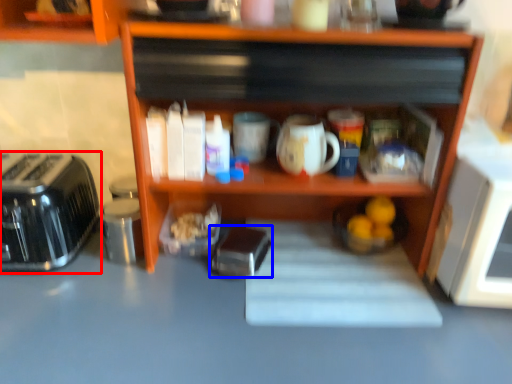
Question: Which object appears closest to the camera in this image, toaster (highlighted by a red box) or appliance (highlighted by a blue box)?

Choices:
 (A) toaster
 (B) appliance

Answer: (A)